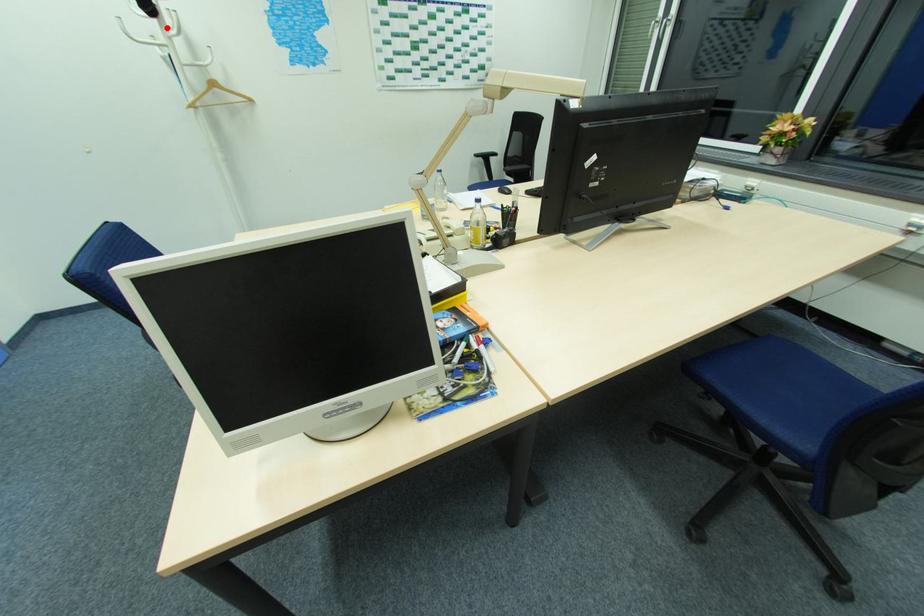
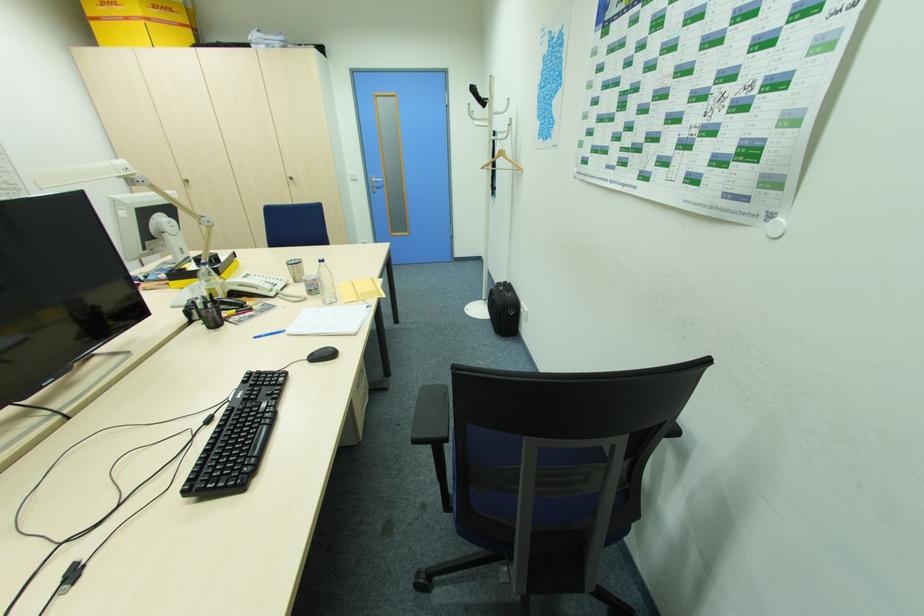
Locate, in the second image, the point that corresponds to the highlighted location in the first image.

(493, 113)